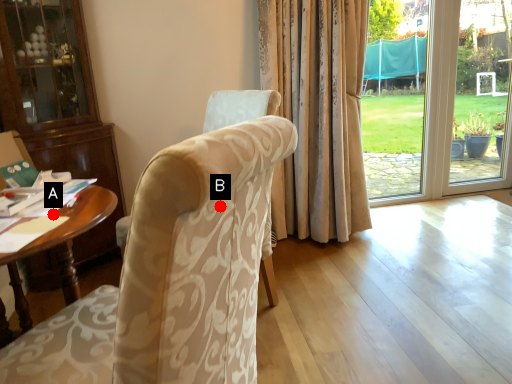
Question: Two points are circled on the image, labeled by A and B beside each circle. Among these points, which one is farthest from the camera?

Choices:
 (A) A is further
 (B) B is further

Answer: (A)